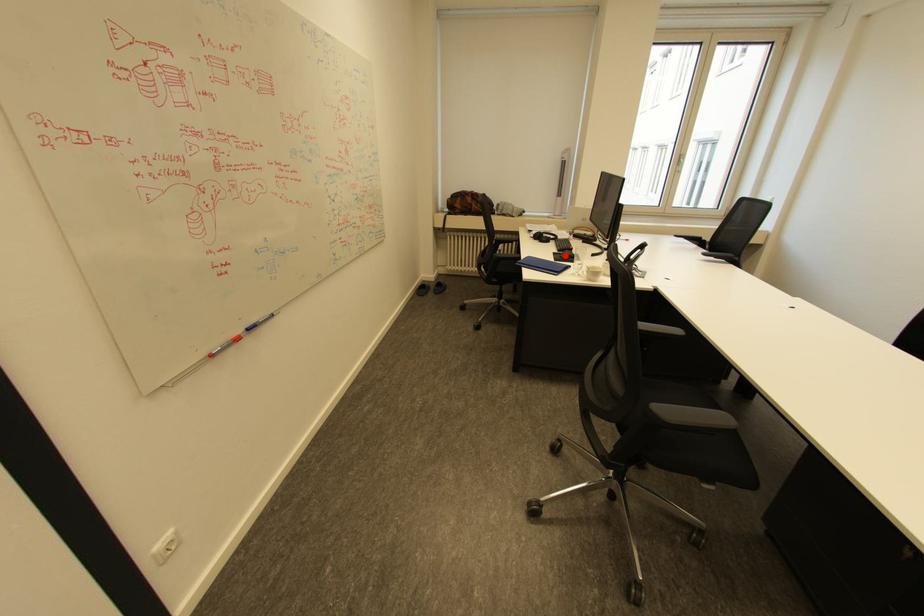
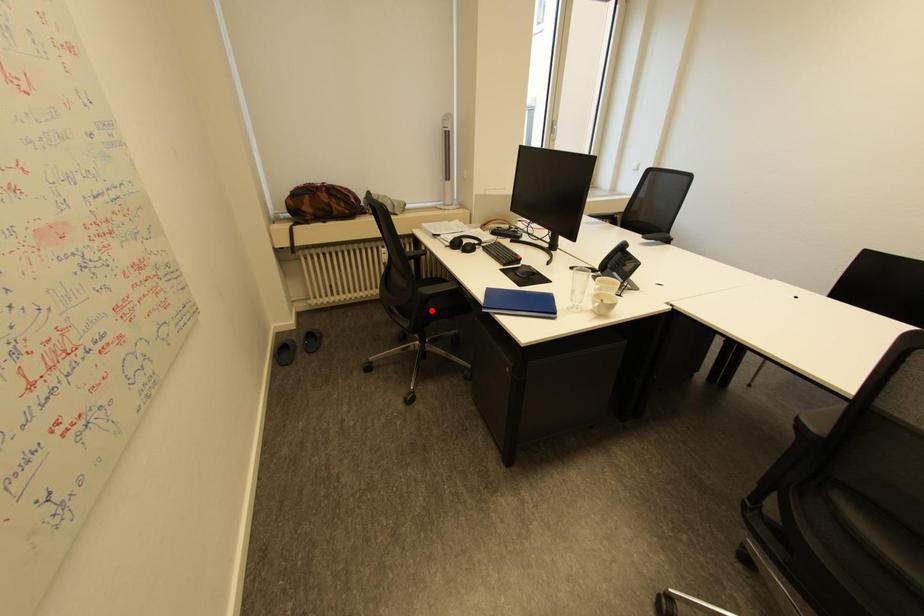
I am providing you with two images of the same scene from different viewpoints. A red point is marked on the first image and another point is marked on the second image. Is the red point in image1 aligned with the point shown in image2?

No